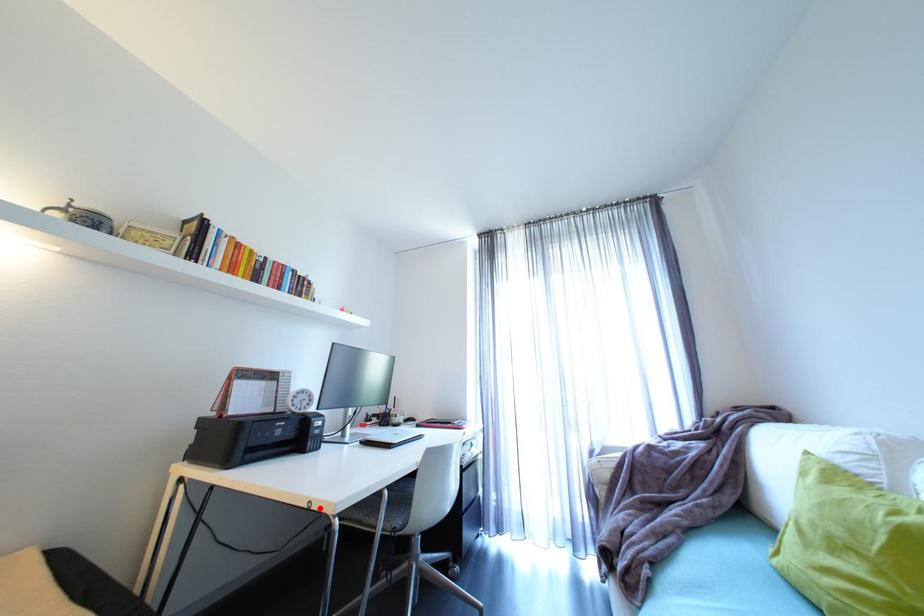
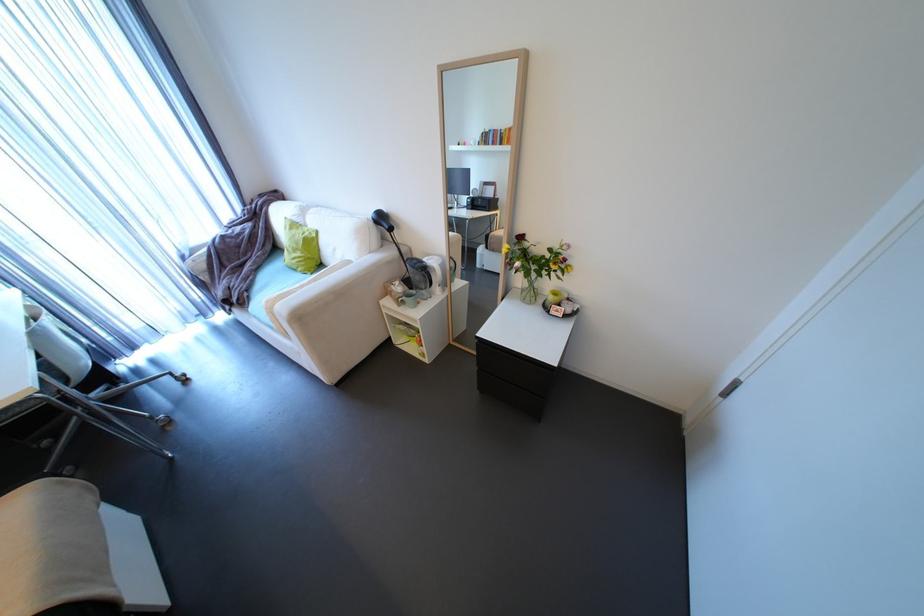
In the second image, find the point that corresponds to the highlighted location in the first image.

(7, 408)